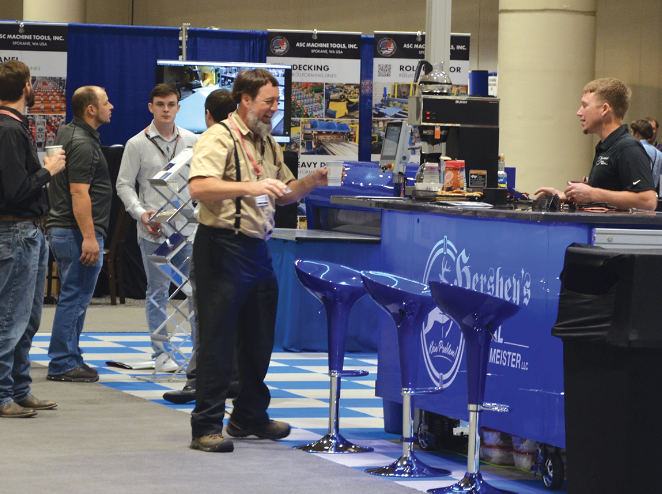
Locate an element on the screen. This screenshot has height=494, width=662. chairs is located at coordinates (391, 291), (348, 281), (455, 300).